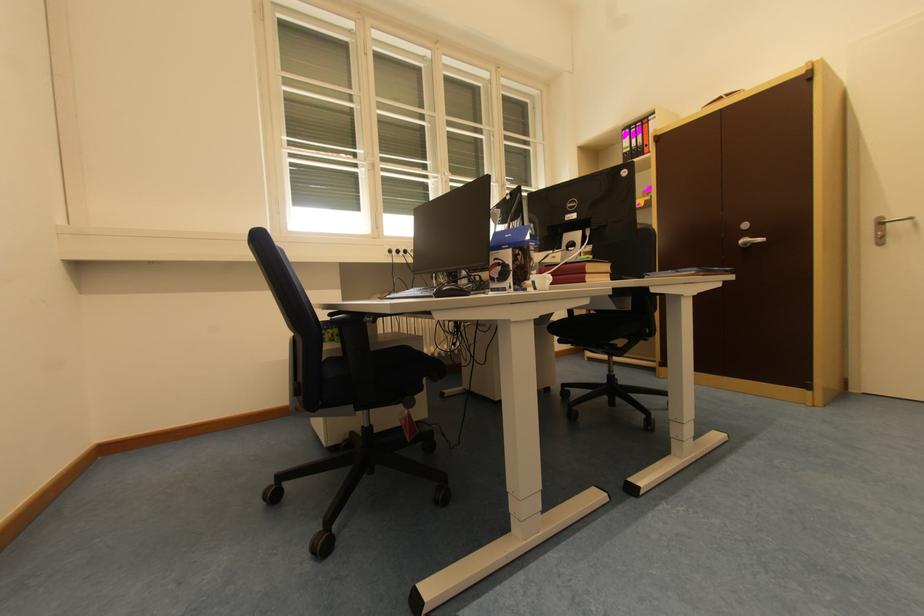
Where is `white coffee mug`? The height and width of the screenshot is (616, 924). white coffee mug is located at coordinates (541, 281).